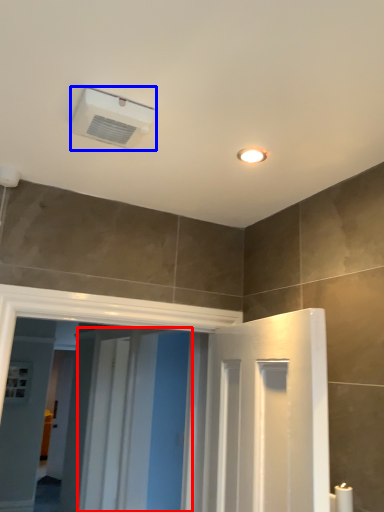
Question: Among these objects, which one is nearest to the camera, screen door (highlighted by a red box) or air conditioning (highlighted by a blue box)?

Choices:
 (A) screen door
 (B) air conditioning

Answer: (B)